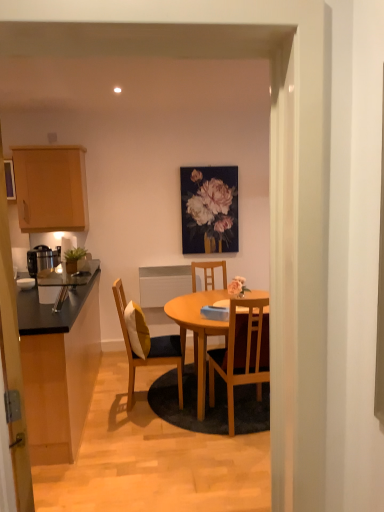
This screenshot has width=384, height=512. Describe the element at coordinates (42, 259) in the screenshot. I see `satin silver coffee maker at left` at that location.

Find the location of a particular element. This screenshot has width=384, height=512. wooden chair at center, which is the 3th chair from front to back is located at coordinates (206, 273).

This screenshot has height=512, width=384. What do you see at coordinates (150, 349) in the screenshot? I see `wooden chair with cushion at center, positioned as the 2th chair in back-to-front order` at bounding box center [150, 349].

This screenshot has height=512, width=384. Identify the location of transparent glass door at left. (13, 362).

Considering the points (226, 342) and (27, 257), which point is in front, point (226, 342) or point (27, 257)?

The point (226, 342) is more forward.

Who is bigger, wooden chair at center, which ranks as the 2th chair in left-to-right order, or satin silver coffee maker at left?

wooden chair at center, which ranks as the 2th chair in left-to-right order.

From the image's perspective, does wooden chair at center, which is the 3th chair from front to back, appear higher than satin silver coffee maker at left?

No, from the image's perspective, wooden chair at center, which is the 3th chair from front to back, is not on top of satin silver coffee maker at left.

Would you say wooden chair at center, which ranks as the 2th chair in left-to-right order, is to the left or to the right of satin silver coffee maker at left in the picture?

In the image, wooden chair at center, which ranks as the 2th chair in left-to-right order, appears on the right side of satin silver coffee maker at left.

Is black laminate countertop at left, which is the first cabinetry in bottom-to-top order, aimed at wooden chair at center, which ranks as the 1th chair in front-to-back order?

No, black laminate countertop at left, which is the first cabinetry in bottom-to-top order, does not turn towards wooden chair at center, which ranks as the 1th chair in front-to-back order.

From the image's perspective, between black laminate countertop at left, marked as the second cabinetry in a top-to-bottom arrangement, and wooden chair at center, arranged as the third chair when viewed from the left, who is located below?

black laminate countertop at left, marked as the second cabinetry in a top-to-bottom arrangement, is shown below in the image.

Is wooden chair at center, which ranks as the 2th chair in left-to-right order, not within wooden chair at center, arranged as the third chair when viewed from the left?

That's correct, wooden chair at center, which ranks as the 2th chair in left-to-right order, is outside of wooden chair at center, arranged as the third chair when viewed from the left.

Locate an element on the screen. The width and height of the screenshot is (384, 512). chair that is the 2nd object located behind the wooden chair at center, which is the first chair from right to left is located at coordinates (206, 273).

Between wooden chair at center, the 2th chair in the right-to-left sequence, and wooden chair at center, which ranks as the 1th chair in front-to-back order, which one has more height?

wooden chair at center, which ranks as the 1th chair in front-to-back order, is taller.

Considering the sizes of objects wooden chair at center, which ranks as the 2th chair in left-to-right order, and wooden chair at center, which ranks as the 1th chair in front-to-back order, in the image provided, who is wider, wooden chair at center, which ranks as the 2th chair in left-to-right order, or wooden chair at center, which ranks as the 1th chair in front-to-back order,?

wooden chair at center, which ranks as the 2th chair in left-to-right order.

In the scene shown: Does black laminate countertop at left, marked as the second cabinetry in a top-to-bottom arrangement, have a lesser height compared to wooden chair at center, which ranks as the 2th chair in left-to-right order?

Yes, black laminate countertop at left, marked as the second cabinetry in a top-to-bottom arrangement, is shorter than wooden chair at center, which ranks as the 2th chair in left-to-right order.

From a real-world perspective, is black laminate countertop at left, which is the first cabinetry in bottom-to-top order, on top of wooden chair at center, the 2th chair in the right-to-left sequence?

No, from a real-world perspective, black laminate countertop at left, which is the first cabinetry in bottom-to-top order, is not on top of wooden chair at center, the 2th chair in the right-to-left sequence.

Would you say black laminate countertop at left, which is the first cabinetry in bottom-to-top order, is inside or outside wooden chair at center, which ranks as the 1th chair in back-to-front order?

black laminate countertop at left, which is the first cabinetry in bottom-to-top order, is not inside wooden chair at center, which ranks as the 1th chair in back-to-front order, it's outside.

Could you tell me if black laminate countertop at left, marked as the second cabinetry in a top-to-bottom arrangement, is turned towards wooden chair at center, the 2th chair in the right-to-left sequence?

No, black laminate countertop at left, marked as the second cabinetry in a top-to-bottom arrangement, is not oriented towards wooden chair at center, the 2th chair in the right-to-left sequence.

Consider the image. From the image's perspective, is matte floral painting at upper center above wooden chair with cushion at center, the third chair viewed from the right?

Yes, from the image's perspective, matte floral painting at upper center is on top of wooden chair with cushion at center, the third chair viewed from the right.

From a real-world perspective, does matte floral painting at upper center sit lower than wooden chair with cushion at center, the 2th chair when ordered from front to back?

Incorrect, from a real-world perspective, matte floral painting at upper center is higher than wooden chair with cushion at center, the 2th chair when ordered from front to back.

Could you tell me if matte floral painting at upper center is facing wooden chair with cushion at center, the 2th chair when ordered from front to back?

No, matte floral painting at upper center is not aimed at wooden chair with cushion at center, the 2th chair when ordered from front to back.

How far apart are matte floral painting at upper center and wooden chair with cushion at center, the third chair viewed from the right?

A distance of 1.41 meters exists between matte floral painting at upper center and wooden chair with cushion at center, the third chair viewed from the right.

Does wooden chair with cushion at center, positioned as the first chair in left-to-right order, have a smaller size compared to black laminate countertop at left, which is the first cabinetry in bottom-to-top order?

Yes, wooden chair with cushion at center, positioned as the first chair in left-to-right order, is smaller than black laminate countertop at left, which is the first cabinetry in bottom-to-top order.

Which is more to the left, wooden chair with cushion at center, positioned as the first chair in left-to-right order, or black laminate countertop at left, marked as the second cabinetry in a top-to-bottom arrangement?

Positioned to the left is black laminate countertop at left, marked as the second cabinetry in a top-to-bottom arrangement.

Between point (160, 346) and point (85, 361), which one is positioned behind?

The point (85, 361) is farther from the camera.

Can you confirm if wooden chair with cushion at center, the third chair viewed from the right, is shorter than black laminate countertop at left, which is the first cabinetry in bottom-to-top order?

Incorrect, the height of wooden chair with cushion at center, the third chair viewed from the right, does not fall short of that of black laminate countertop at left, which is the first cabinetry in bottom-to-top order.

From the image's perspective, is wooden chair at center, which is counted as the third chair, starting from the back, below matte floral painting at upper center?

Yes, from the image's perspective, wooden chair at center, which is counted as the third chair, starting from the back, is beneath matte floral painting at upper center.

Which of these two, wooden chair at center, which ranks as the 1th chair in front-to-back order, or matte floral painting at upper center, is bigger?

Bigger between the two is wooden chair at center, which ranks as the 1th chair in front-to-back order.

Could you tell me if wooden chair at center, which ranks as the 1th chair in front-to-back order, is turned towards matte floral painting at upper center?

Yes, wooden chair at center, which ranks as the 1th chair in front-to-back order, is turned towards matte floral painting at upper center.

Is point (257, 380) closer or farther from the camera than point (189, 244)?

Point (257, 380) is closer to the camera than point (189, 244).

Starting from the satin silver coffee maker at left, which chair is the 1st one in front? Please provide its 2D coordinates.

[(206, 273)]

The height and width of the screenshot is (512, 384). Find the location of `chair that is the 1st one when counting backward from the black laminate countertop at left, which is the first cabinetry in bottom-to-top order`. chair that is the 1st one when counting backward from the black laminate countertop at left, which is the first cabinetry in bottom-to-top order is located at coordinates (243, 355).

In the scene shown: Looking at the image, which one is located closer to wooden chair with cushion at center, the 2th chair when ordered from front to back, transparent glass door at left or matte floral painting at upper center?

matte floral painting at upper center is closer to wooden chair with cushion at center, the 2th chair when ordered from front to back.

Considering their positions, is satin silver coffee maker at left positioned closer to wooden chair with cushion at center, the third chair viewed from the right, than wooden chair at center, which is the first chair from right to left?

wooden chair at center, which is the first chair from right to left.

Estimate the real-world distances between objects in this image. Which object is closer to wooden chair at center, which ranks as the 1th chair in back-to-front order, wooden chair at center, which ranks as the 1th chair in front-to-back order, or black laminate countertop at left, marked as the second cabinetry in a top-to-bottom arrangement?

wooden chair at center, which ranks as the 1th chair in front-to-back order, is positioned closer to the anchor wooden chair at center, which ranks as the 1th chair in back-to-front order.

Based on their spatial positions, is wooden chair at center, which is counted as the third chair, starting from the back, or satin silver coffee maker at left closer to transparent glass door at left?

Based on the image, wooden chair at center, which is counted as the third chair, starting from the back, appears to be nearer to transparent glass door at left.

When comparing their distances from satin silver coffee maker at left, does wooden chair with cushion at center, the third chair viewed from the right, or black laminate countertop at left, which is the first cabinetry in bottom-to-top order, seem further?

wooden chair with cushion at center, the third chair viewed from the right, is positioned further to the anchor satin silver coffee maker at left.

Estimate the real-world distances between objects in this image. Which object is closer to black laminate countertop at left, marked as the second cabinetry in a top-to-bottom arrangement, matte floral painting at upper center or satin silver coffee maker at left?

satin silver coffee maker at left lies closer to black laminate countertop at left, marked as the second cabinetry in a top-to-bottom arrangement, than the other object.

From the image, which object appears to be nearer to transparent glass door at left, satin silver coffee maker at left or black laminate countertop at left, marked as the second cabinetry in a top-to-bottom arrangement?

Based on the image, black laminate countertop at left, marked as the second cabinetry in a top-to-bottom arrangement, appears to be nearer to transparent glass door at left.

Based on their spatial positions, is black laminate countertop at left, which is the first cabinetry in bottom-to-top order, or wooden chair at center, which is counted as the third chair, starting from the back, further from wooden chair with cushion at center, the third chair viewed from the right?

black laminate countertop at left, which is the first cabinetry in bottom-to-top order, lies further to wooden chair with cushion at center, the third chair viewed from the right, than the other object.

The image size is (384, 512). Find the location of `chair positioned between wooden chair at center, which is counted as the third chair, starting from the back, and wooden chair at center, which ranks as the 2th chair in left-to-right order, from near to far`. chair positioned between wooden chair at center, which is counted as the third chair, starting from the back, and wooden chair at center, which ranks as the 2th chair in left-to-right order, from near to far is located at coordinates pos(150,349).

Image resolution: width=384 pixels, height=512 pixels. Find the location of `chair situated between black laminate countertop at left, which is the first cabinetry in bottom-to-top order, and wooden chair at center, which is the 3th chair from front to back, from left to right`. chair situated between black laminate countertop at left, which is the first cabinetry in bottom-to-top order, and wooden chair at center, which is the 3th chair from front to back, from left to right is located at coordinates (150, 349).

Locate an element on the screen. This screenshot has height=512, width=384. chair between wooden cabinet at upper left, the second cabinetry when ordered from bottom to top, and wooden chair at center, which ranks as the 1th chair in back-to-front order, from left to right is located at coordinates (150, 349).

The image size is (384, 512). In order to click on appliance located between transparent glass door at left and matte floral painting at upper center in the depth direction in this screenshot , I will do `click(42, 259)`.